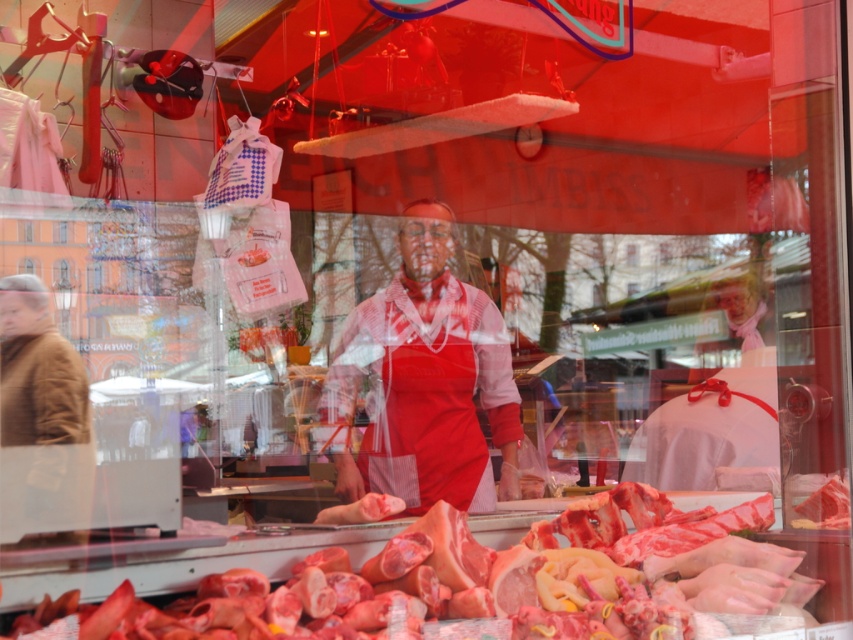
You are standing outside the butcher shop looking through the window. You want to grab the pinkish raw meat at center. Can you reach it from where you are standing?

The pinkish raw meat at center is 4.44 feet away from the viewer, so you cannot reach it from outside the butcher shop.

You are a customer standing outside the butcher shop looking through the window. You notice the pinkish raw meat at center and the brown wool coat at left. Which object appears closer to you in the scene?

The pinkish raw meat at center appears closer to you than the brown wool coat at left because it is shorter, making it seem nearer in the perspective of the image.